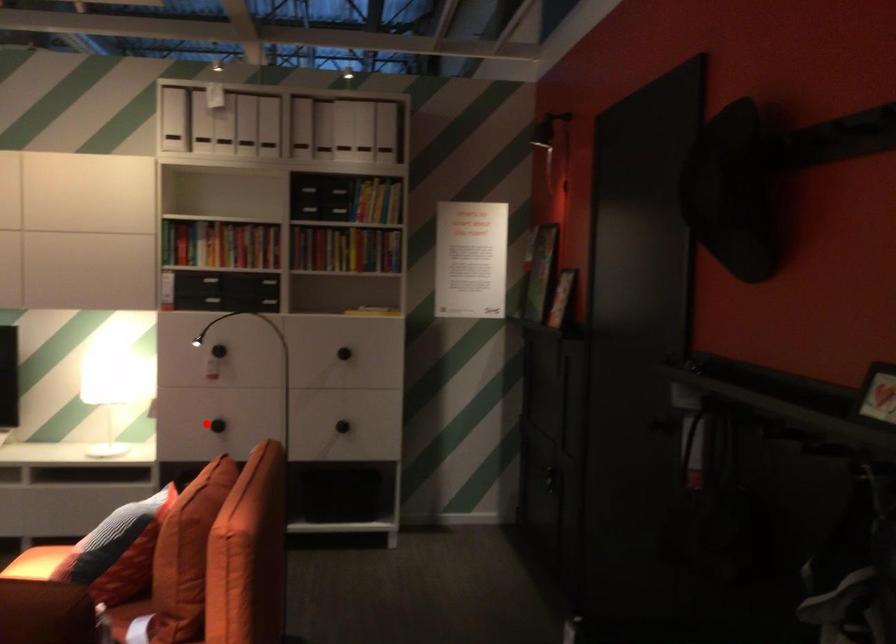
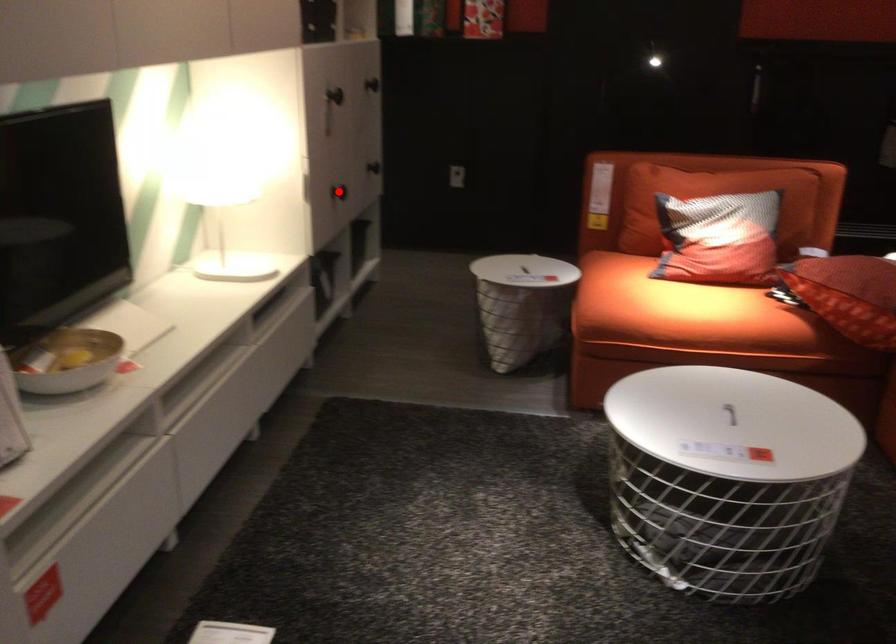
I am providing you with two images of the same scene from different viewpoints. A red point is marked on the first image and another point is marked on the second image. Does the point marked in image1 correspond to the same location as the one in image2?

Yes